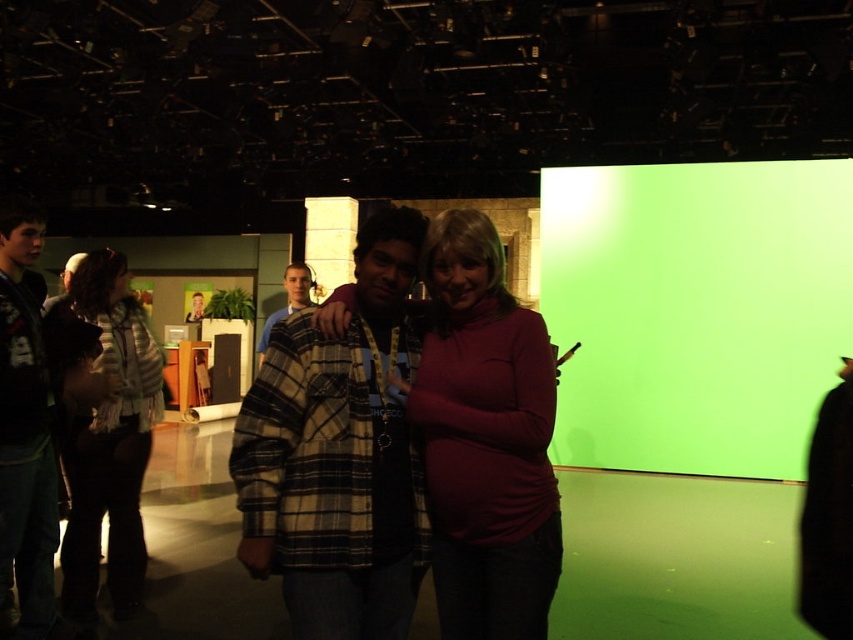
Question: Which object appears closest to the camera in this image?

Choices:
 (A) matte red sweater at center
 (B) plaid fabric shirt at center
 (C) plaid wool sweater at center

Answer: (B)

Question: Does plaid fabric shirt at center have a greater width compared to matte red sweater at center?

Choices:
 (A) no
 (B) yes

Answer: (A)

Question: Which point is closer to the camera taking this photo?

Choices:
 (A) pyautogui.click(x=299, y=292)
 (B) pyautogui.click(x=35, y=260)

Answer: (B)

Question: Considering the real-world distances, which object is closest to the plaid fabric shirt at center?

Choices:
 (A) matte red sweater at center
 (B) dark green plaid shirt at left
 (C) plaid wool sweater at center
 (D) striped knit sweater at left

Answer: (A)

Question: In this image, where is dark green plaid shirt at left located relative to plaid wool sweater at center?

Choices:
 (A) left
 (B) right

Answer: (A)

Question: Can you confirm if plaid fabric shirt at center is smaller than striped knit sweater at left?

Choices:
 (A) yes
 (B) no

Answer: (A)